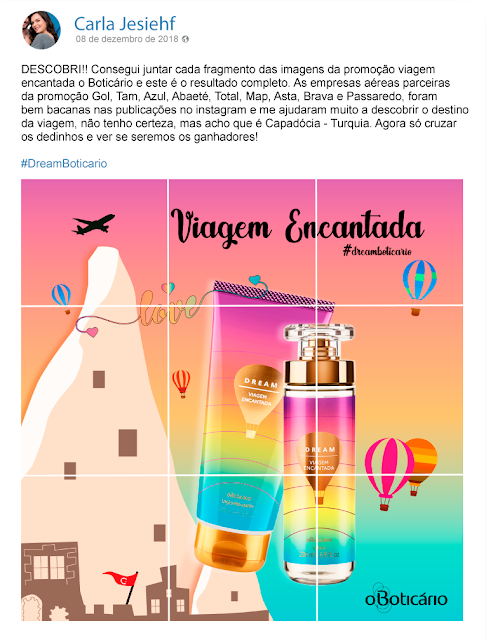
Locate an element on the screen. lotion is located at coordinates (210, 413).